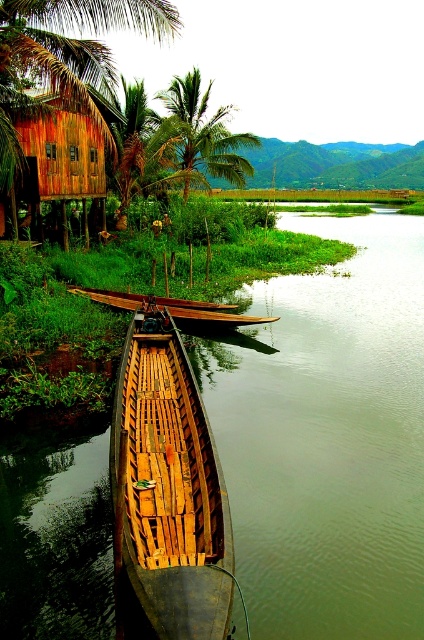
You are standing at the wooden boat docked on calm, reflective water and want to locate the wooden hut at upper left. Which direction should you look to see the point at coordinates (60, 154)?

The point at coordinates (60, 154) is located on the wooden hut at upper left, so you should look to your left to see it.

You are standing at the center of the wooden boat docked on calm, reflective water. Looking towards the upper left corner of the scene, can you see the brown wooden palm tree at upper left? Please provide your answer based on the coordinates provided.

Yes, the brown wooden palm tree at upper left is located at coordinates point (x=64, y=58), which is within the upper left area of the scene.